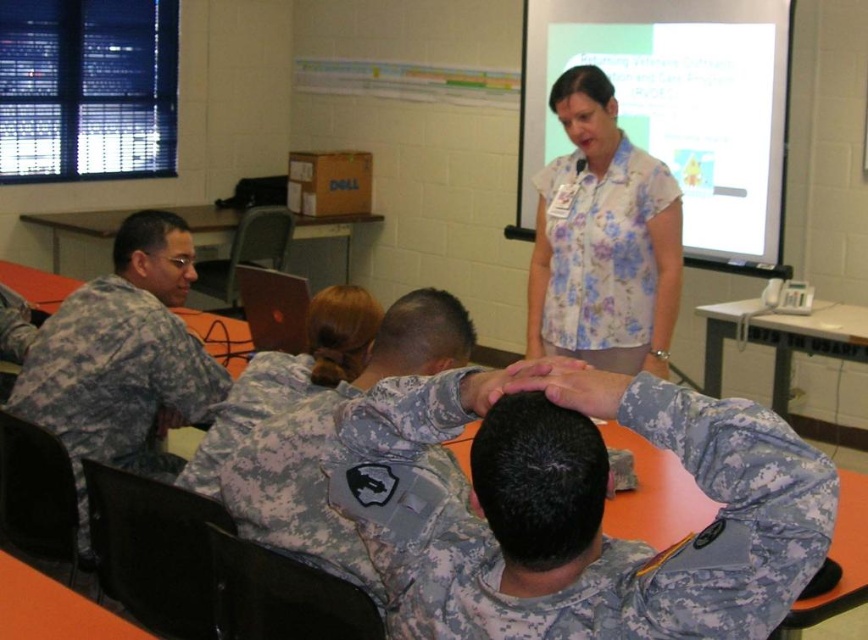
From the picture: You are an observer in the room. You notice the camouflage uniform at left and the floral print blouse at upper center. Which clothing item takes up more visual space in the scene?

The camouflage uniform at left is larger in size than the floral print blouse at upper center, so it takes up more visual space in the scene.

You are a military trainee who needs to move from the camouflage uniform at left to the floral print blouse at upper center. Can you reach there without moving any objects?

The distance between the camouflage uniform at left and the floral print blouse at upper center is 4.82 feet, so yes, you can reach there without moving any objects as the space is sufficient for movement.

You are a photographer in the room and want to capture a photo that includes both the floral print blouse at upper center and the camouflage fabric uniform at center. Which object should you focus on first to ensure both are in frame?

The floral print blouse at upper center is taller than the camouflage fabric uniform at center, so you should focus on the floral print blouse at upper center first to ensure both are in frame.